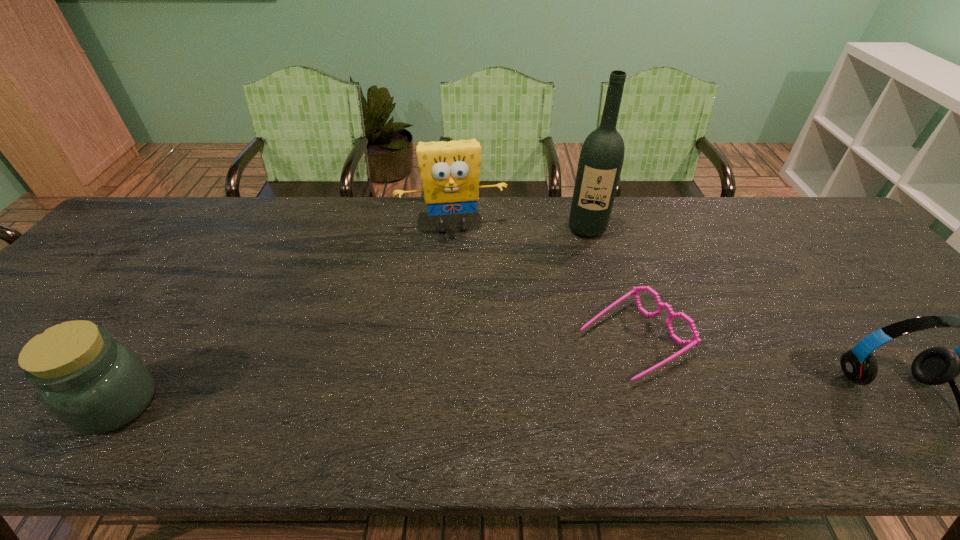
In the image, there is a desktop. What are the coordinates of `free space at the near edge` in the screenshot? It's located at (664, 403).

Where is `free space at the left edge of the desktop`? free space at the left edge of the desktop is located at coordinates (96, 291).

Where is `free space at the far left corner of the desktop`? The image size is (960, 540). free space at the far left corner of the desktop is located at coordinates (175, 201).

Where is `vacant space at the near left corner of the desktop`? The height and width of the screenshot is (540, 960). vacant space at the near left corner of the desktop is located at coordinates (36, 394).

Locate an element on the screen. Image resolution: width=960 pixels, height=540 pixels. free point between the sponge and the tallest object is located at coordinates (520, 227).

Identify the location of vacant space that's between the leftmost object and the spectacles. (375, 372).

Identify the location of free space between the leftmost object and the wine bottle. The width and height of the screenshot is (960, 540). (352, 315).

The image size is (960, 540). I want to click on unoccupied area between the spectacles and the tallest object, so click(611, 284).

Find the location of a particular element. free spot between the fourth object from right to left and the shortest object is located at coordinates (543, 283).

Image resolution: width=960 pixels, height=540 pixels. Find the location of `free point between the sponge and the tallest object`. free point between the sponge and the tallest object is located at coordinates (520, 227).